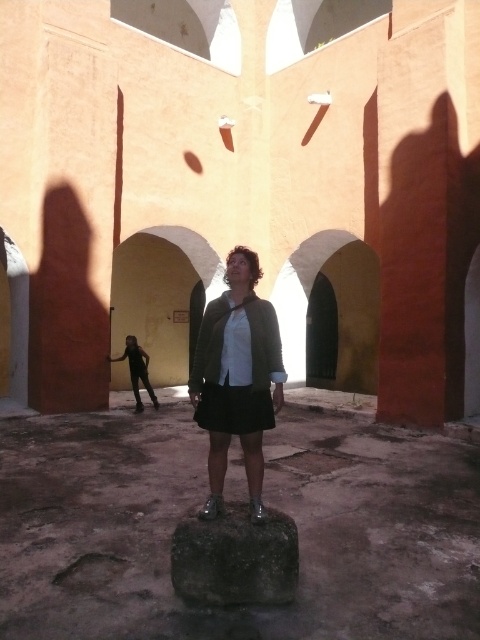
Does matte black skirt at center have a greater width compared to dark gray stone at center?

Incorrect, matte black skirt at center's width does not surpass dark gray stone at center's.

Is matte black skirt at center above dark gray stone at center?

Yes, matte black skirt at center is above dark gray stone at center.

The height and width of the screenshot is (640, 480). I want to click on matte black skirt at center, so (x=237, y=378).

Locate an element on the screen. The height and width of the screenshot is (640, 480). matte black skirt at center is located at coordinates (237, 378).

Which is behind, point (420, 456) or point (172, 580)?

The point (420, 456) is behind.

Is point (97, 600) positioned after point (189, 524)?

No, (97, 600) is in front of (189, 524).

Who is more forward, (159, 630) or (230, 572)?

Point (159, 630) is in front.

At what (x,y) coordinates should I click in order to perform the action: click on smooth stone at center. Please return your answer as a coordinate pair (x, y). The width and height of the screenshot is (480, 640). Looking at the image, I should click on (265, 502).

Is matte black skirt at center above black fabric pants at lower left?

Correct, matte black skirt at center is located above black fabric pants at lower left.

Between matte black skirt at center and black fabric pants at lower left, which one appears on the left side from the viewer's perspective?

black fabric pants at lower left

Which is behind, point (236, 262) or point (142, 404)?

The point (142, 404) is behind.

Locate an element on the screen. The image size is (480, 640). matte black skirt at center is located at coordinates tap(237, 378).